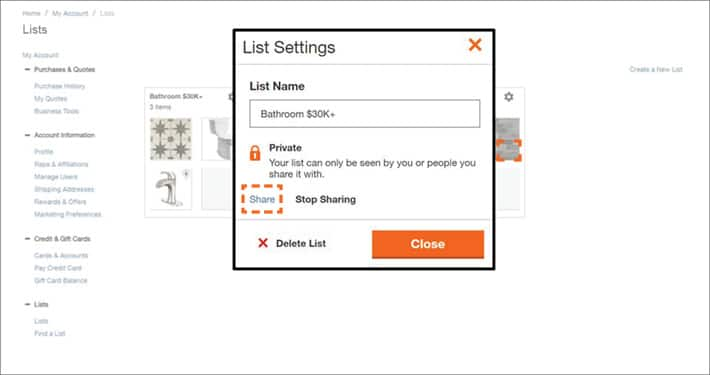
Identify the location of images of bathroom fittings. Image resolution: width=710 pixels, height=375 pixels. (160, 129), (178, 181), (216, 137), (214, 201).